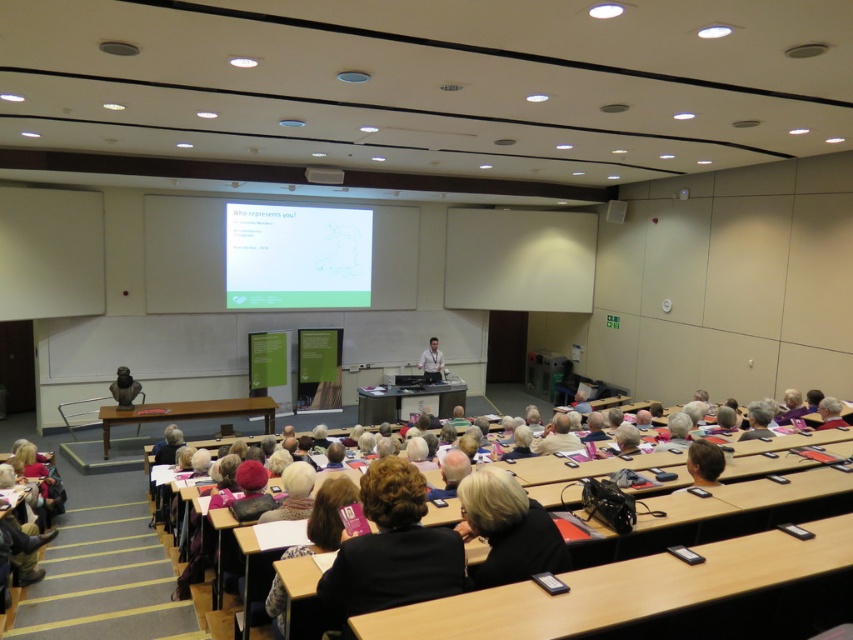
You are an attendee in the lecture hall and need to take a photo of the white matte projector screen at upper center and the matte bronze bust at lower left. Which object should you focus on first if you want to capture both in the same frame without moving your camera?

The white matte projector screen at upper center should be focused on first because its width is larger than the matte bronze bust at lower left, so it will require more space in the frame.

You are sitting in the lecture hall and want to place your notebook on the smooth wooden desk at lower center. To reach it from your current position at the dark gray sweater at center, which direction should you move?

Result: To reach the smooth wooden desk at lower center from the dark gray sweater at center, you should move to the right since the smooth wooden desk at lower center is located to the right of the dark gray sweater at center.